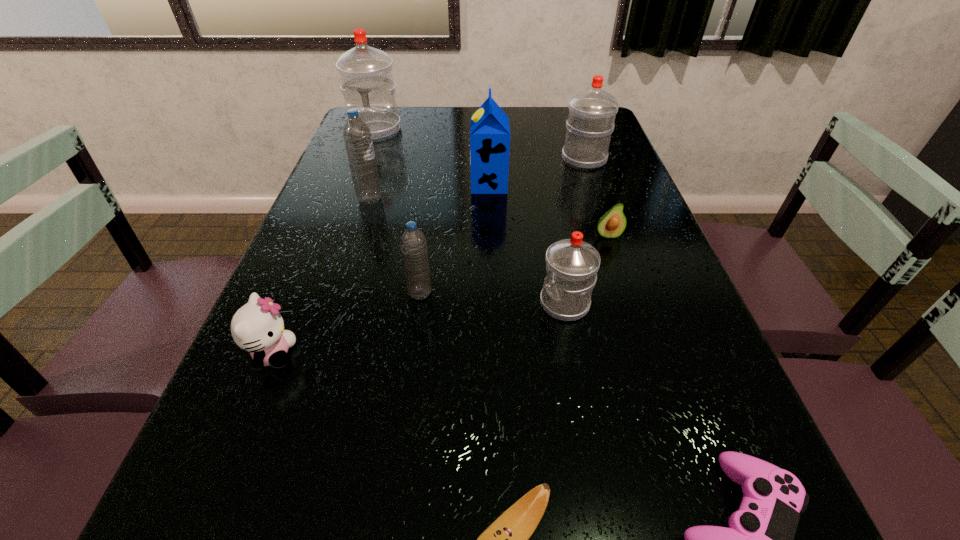
Where is `the right blue water bottle`? This screenshot has height=540, width=960. the right blue water bottle is located at coordinates (413, 243).

Image resolution: width=960 pixels, height=540 pixels. I want to click on the eighth farthest object, so click(257, 327).

The image size is (960, 540). Find the location of `the fourth shortest object`. the fourth shortest object is located at coordinates (257, 327).

Find the location of a particular element. the fifth farthest object is located at coordinates (612, 224).

Locate an element on the screen. Image resolution: width=960 pixels, height=540 pixels. green avocado is located at coordinates (612, 224).

Where is `vacant space located on the handle side of the farthest water bottle`? This screenshot has height=540, width=960. vacant space located on the handle side of the farthest water bottle is located at coordinates (348, 206).

Where is `blank area located with the cap open on the blue carton`? The image size is (960, 540). blank area located with the cap open on the blue carton is located at coordinates (380, 184).

The height and width of the screenshot is (540, 960). I want to click on blank area located with the cap open on the blue carton, so click(x=329, y=184).

Where is `vacant area situated with the cap open on the blue carton`? This screenshot has width=960, height=540. vacant area situated with the cap open on the blue carton is located at coordinates (423, 184).

This screenshot has height=540, width=960. I want to click on free space located on the handle side of the second farthest water bottle, so click(566, 107).